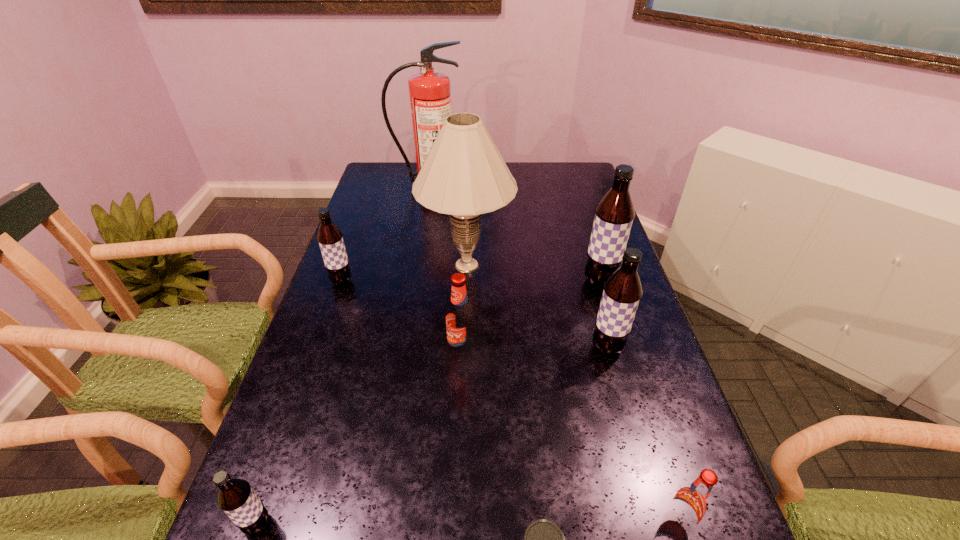
I want to click on vacant area located on the left of the right red root beer, so click(x=444, y=523).

You are a GUI agent. You are given a task and a screenshot of the screen. Output one action in this format:
    pyautogui.click(x=<x>, y=<y>)
    Task: Click on the object at the far edge
    This screenshot has width=960, height=540.
    Given the screenshot: What is the action you would take?
    pyautogui.click(x=430, y=98)

The image size is (960, 540). Identify the location of fire extinguisher present at the left edge. (430, 98).

At what (x,y) coordinates should I click in order to perform the action: click on object that is positioned at the far left corner. Please return your answer as a coordinate pair (x, y). The image size is (960, 540). Looking at the image, I should click on (430, 98).

This screenshot has height=540, width=960. In the image, there is a desktop. Identify the location of vacant space at the far edge. (535, 171).

Image resolution: width=960 pixels, height=540 pixels. I want to click on blank space at the left edge of the desktop, so click(x=297, y=536).

Identify the location of vacant region at the right edge of the desktop. (583, 200).

Image resolution: width=960 pixels, height=540 pixels. What are the coordinates of `free area in between the lampshade and the second smallest brown root beer` in the screenshot? It's located at (404, 273).

You are a GUI agent. You are given a task and a screenshot of the screen. Output one action in this format:
    pyautogui.click(x=<x>, y=<y>)
    Task: Click on the vacant space that's between the sixth shortest object and the second smallest brown root beer
    
    Given the screenshot: What is the action you would take?
    pyautogui.click(x=474, y=315)

What are the coordinates of `free spot between the biggest brown root beer and the red fire extinguisher` in the screenshot? It's located at (514, 234).